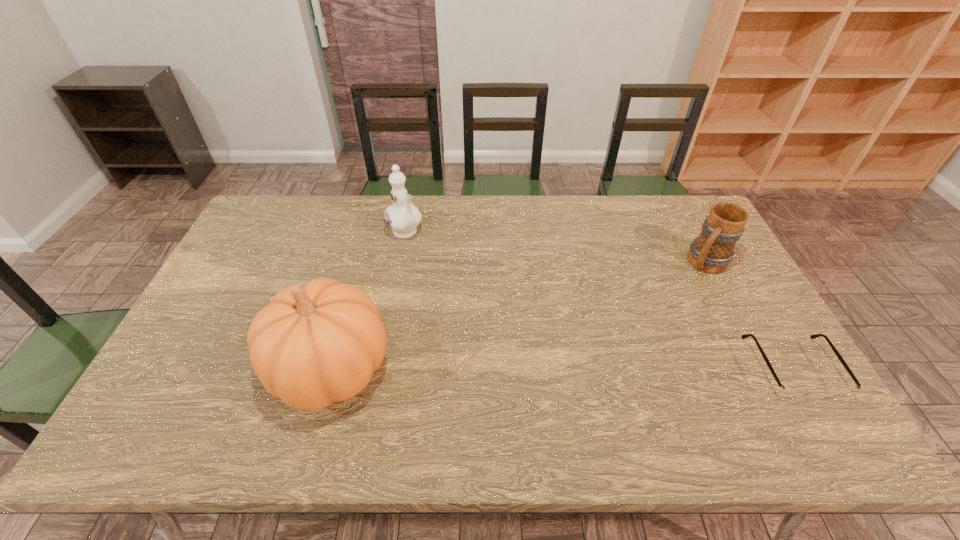
Identify the location of free spot between the chinaware and the third nearest object. (555, 248).

You are a GUI agent. You are given a task and a screenshot of the screen. Output one action in this format:
    pyautogui.click(x=<x>, y=<y>)
    Task: Click on the vacant area that lies between the shortest object and the mug
    The image size is (960, 540).
    Given the screenshot: What is the action you would take?
    pyautogui.click(x=749, y=316)

Locate an element on the screen. This screenshot has height=540, width=960. vacant area that lies between the pumpkin and the third tallest object is located at coordinates (x=517, y=316).

Locate an element on the screen. This screenshot has width=960, height=540. object identified as the closest to the third nearest object is located at coordinates (785, 392).

Locate which object is the third closest to the shortest object. Please provide its 2D coordinates. Your answer should be formatted as a tuple, i.e. [(x, y)], where the tuple contains the x and y coordinates of a point satisfying the conditions above.

[(402, 217)]

This screenshot has height=540, width=960. I want to click on free location that satisfies the following two spatial constraints: 1. on the back side of the pumpkin; 2. on the left side of the farthest object, so click(368, 233).

This screenshot has height=540, width=960. Identify the location of vacant point that satisfies the following two spatial constraints: 1. on the back side of the third nearest object; 2. on the right side of the pumpkin. (359, 263).